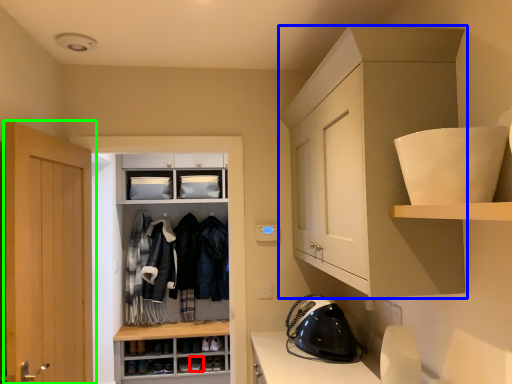
Question: Considering the real-world distances, which object is closest to footwear (highlighted by a red box)? cabinetry (highlighted by a blue box) or door (highlighted by a green box).

Choices:
 (A) cabinetry
 (B) door

Answer: (B)